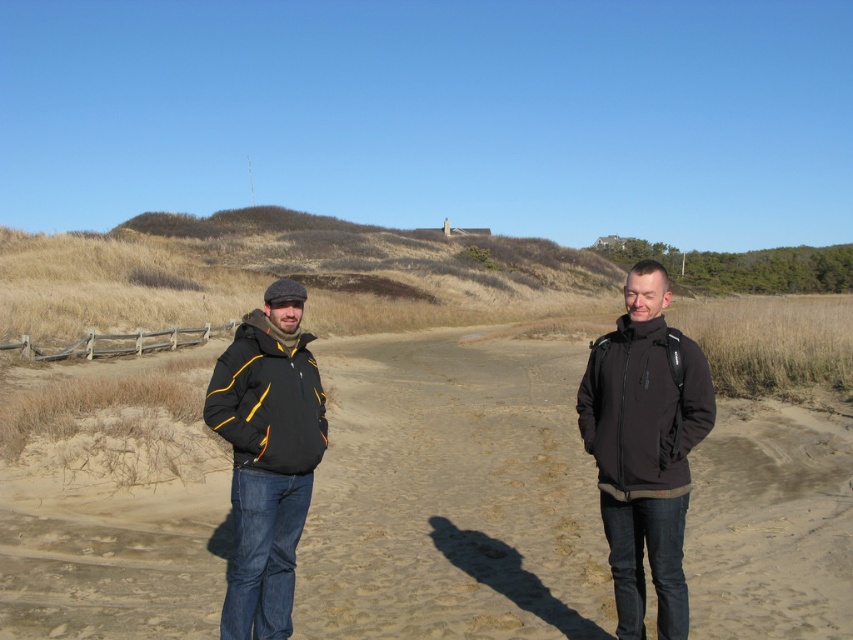
You are a photographer trying to capture a photo of both the black softshell jacket at center and the matte black jacket at left. Since they are close to each other, you need to adjust your camera angle to ensure both are fully visible. Which jacket should you focus on first to frame them properly?

The matte black jacket at left should be focused on first since the black softshell jacket at center is positioned to its right, meaning the matte black jacket at left is closer to the left edge of the frame. By starting with it, you can adjust the angle to include both jackets without cropping either out.